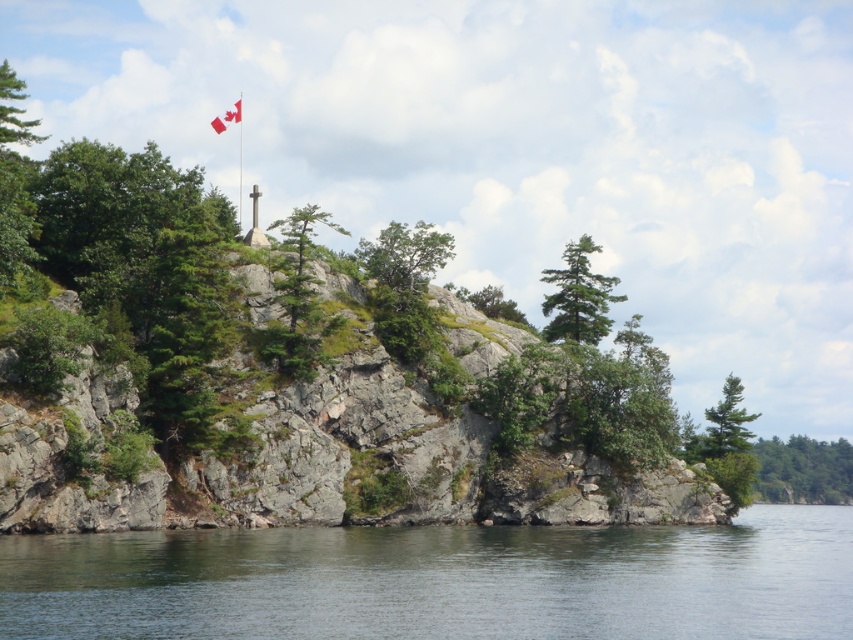
You are a bird flying over the rocky shoreline. You want to land on the closest tree to the Canadian flag at top left. Which tree should you choose between the green leafy tree at center and the green leafy tree at lower right?

The green leafy tree at center is positioned over the green leafy tree at lower right, so the green leafy tree at center is closer to the Canadian flag at top left. You should choose the green leafy tree at center to land on.

You are standing at the shoreline in the image and want to reach the Canadian flag at the top left. There are two points marked in the scene, point A at coordinates point A is point (x=294, y=349) and point B at coordinates point B is point (x=809, y=476). Which point is closer to you as you face the shoreline?

Point A at coordinates point A is point (x=294, y=349) is closer to you because it is in front of point B at coordinates point B is point (x=809, y=476).

You are a photographer standing at the shoreline and want to capture both the clear water at lower center and the green matte tree at right in your shot. Which object should you frame first to ensure both are in the same photo?

You should frame the clear water at lower center first since it is positioned on the left side of the green matte tree at right, ensuring both are included in the photo.